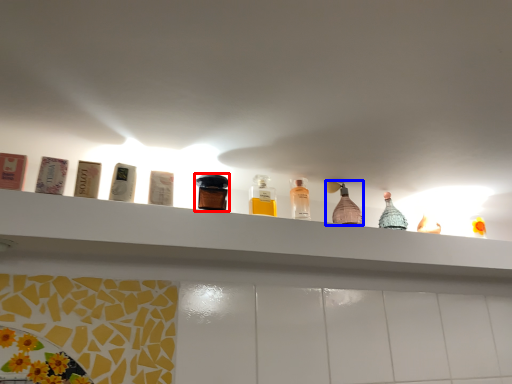
Question: Which object appears closest to the camera in this image, bottle (highlighted by a red box) or bottle (highlighted by a blue box)?

Choices:
 (A) bottle
 (B) bottle

Answer: (A)